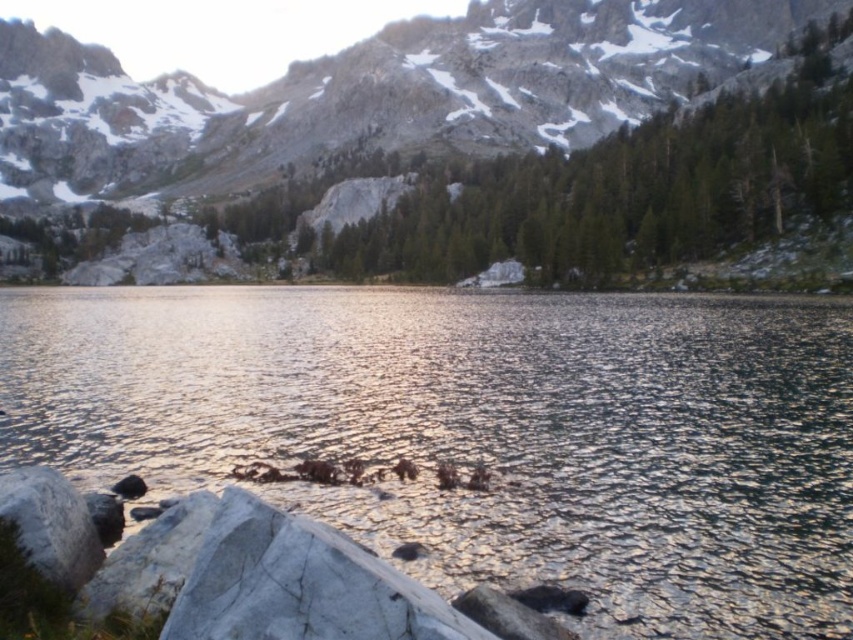
You are standing at the edge of the lake in the serene mountainous landscape. You notice a point marked at coordinates [483,432]. What feature is located at that point?

The point at coordinates [483,432] is where the glistening water at center is located.

You are a hiker navigating the mountain trail and want to reach the glistening water at center. Based on the scene description, which direction should you head towards from your current position at the rocky shoreline?

The glistening water at center is located at point (483, 432) in the scene, which is towards the center area. Since you are on the rocky shoreline in the middle ground, you should head towards the center of the image to reach the glistening water at center.

You are a hiker who wants to capture the reflection of the gray rocky mountain at upper center in the glistening water at center. Based on the scene, will the reflection be fully visible in the water?

The glistening water at center is not as tall as the gray rocky mountain at upper center, so the reflection of the gray rocky mountain at upper center in the glistening water at center will be fully visible because the water is calm and reflective.